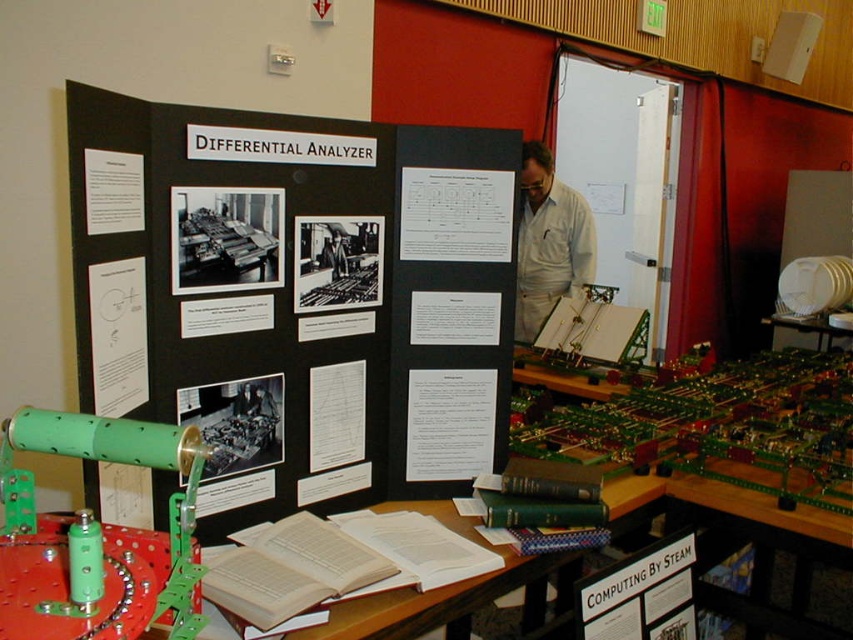
Question: Where is white paper book at center located in relation to light brown leather jacket at center in the image?

Choices:
 (A) below
 (B) above

Answer: (A)

Question: Estimate the real-world distances between objects in this image. Which object is farther from the white paper at upper left?

Choices:
 (A) black paper at center
 (B) black paperboard at center
 (C) green matte cylinder at center
 (D) white paper at center

Answer: (D)

Question: Which of these objects is positioned farthest from the white paper at upper left?

Choices:
 (A) white fabric shirt at center
 (B) green matte cylinder at center

Answer: (A)

Question: Is white paper at center in front of light brown leather jacket at center?

Choices:
 (A) no
 (B) yes

Answer: (A)

Question: Is the position of white paper book at center more distant than that of white paper at center?

Choices:
 (A) no
 (B) yes

Answer: (A)

Question: Which is nearer to the green matte cylinder at center?

Choices:
 (A) light brown leather jacket at center
 (B) wooden table at center

Answer: (B)